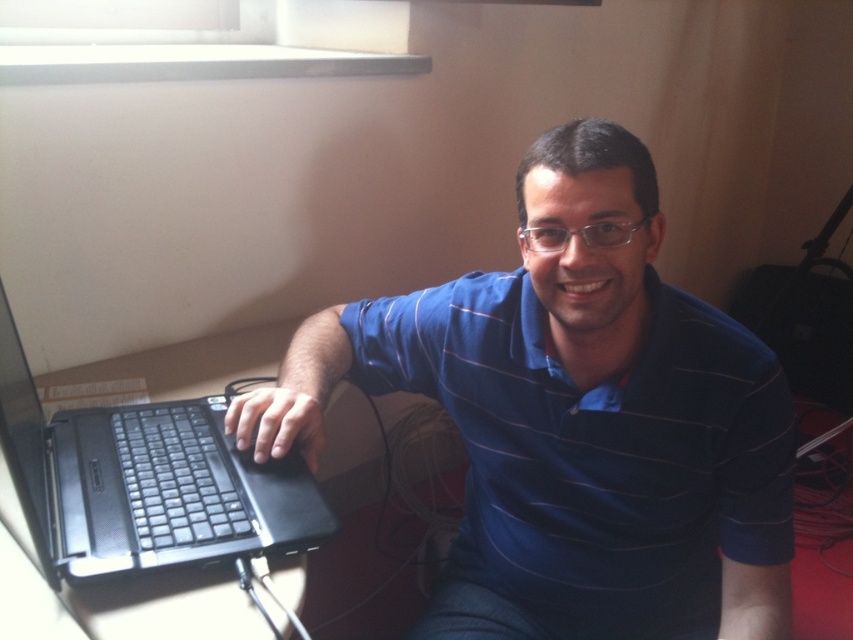
Does point (312, 380) lie in front of point (212, 435)?

No, it is behind (212, 435).

Which is in front, point (741, 362) or point (109, 528)?

Point (109, 528) is in front.

Identify the location of blue striped shirt at center. This screenshot has width=853, height=640. (576, 420).